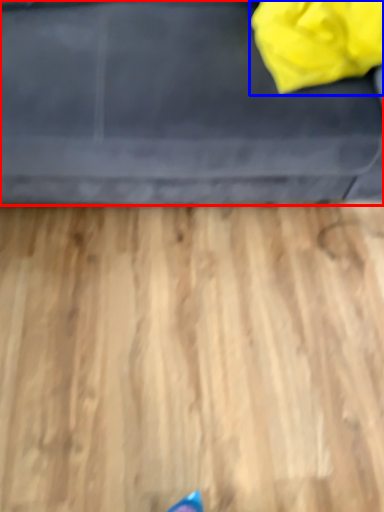
Question: Which point is closer to the camera, furniture (highlighted by a red box) or bag (highlighted by a blue box)?

Choices:
 (A) furniture
 (B) bag

Answer: (A)